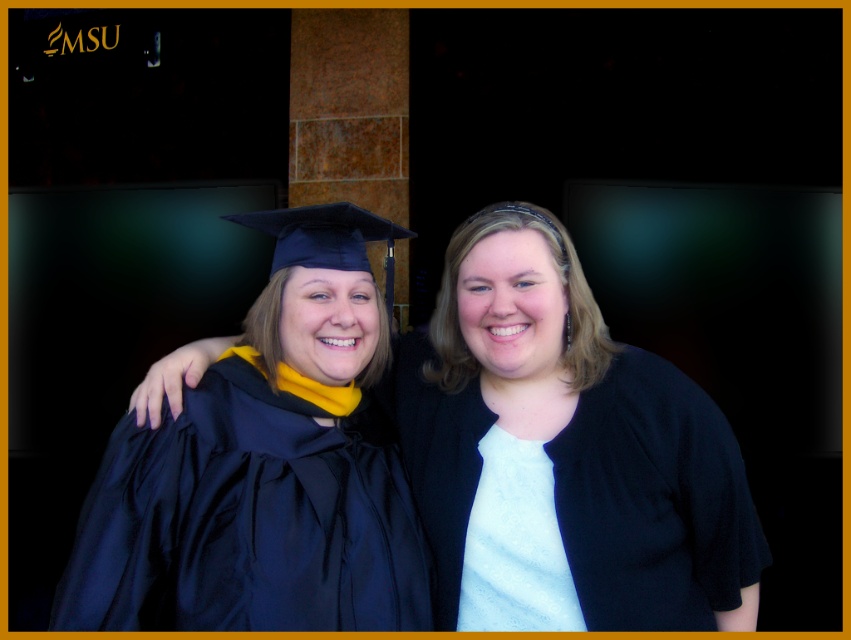
You are organizing a photo album and need to determine which clothing item takes up more space in the image. Based on the scene, which is bigger between the matte black graduation gown at left and the white matte shirt at center?

The matte black graduation gown at left is larger in size than the white matte shirt at center, so the matte black graduation gown at left takes up more space in the image.

You are a photographer trying to adjust the lighting for a group photo. You notice two people in the frame wearing the matte black graduation gown at center and the white matte shirt at center. Which clothing item needs to be lit more carefully to avoid being overwhelmed by the other?

The white matte shirt at center needs to be lit more carefully because it is shorter than the matte black graduation gown at center, making it more likely to be overshadowed in the lighting setup.